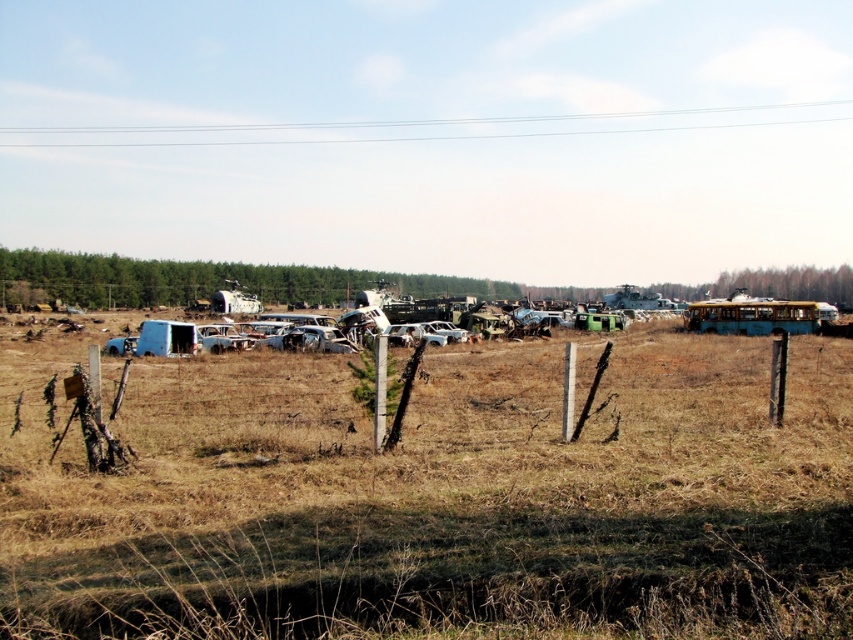
Consider the image. Does brown dry grass at center lie behind silver metallic car at center?

No, it is in front of silver metallic car at center.

Locate an element on the screen. The image size is (853, 640). brown dry grass at center is located at coordinates (434, 493).

The width and height of the screenshot is (853, 640). Find the location of `brown dry grass at center`. brown dry grass at center is located at coordinates click(434, 493).

You are a GUI agent. You are given a task and a screenshot of the screen. Output one action in this format:
    pyautogui.click(x=<x>, y=<y>)
    Task: Click on the brown dry grass at center
    
    Given the screenshot: What is the action you would take?
    pyautogui.click(x=434, y=493)

Consider the image. Who is positioned more to the left, blue matte bus at right or silver metallic car at center?

silver metallic car at center

What do you see at coordinates (753, 316) in the screenshot? I see `blue matte bus at right` at bounding box center [753, 316].

You are a GUI agent. You are given a task and a screenshot of the screen. Output one action in this format:
    pyautogui.click(x=<x>, y=<y>)
    Task: Click on the blue matte bus at right
    
    Given the screenshot: What is the action you would take?
    pyautogui.click(x=753, y=316)

Can you confirm if brown dry grass at center is taller than blue matte bus at right?

No.

This screenshot has width=853, height=640. Identify the location of brown dry grass at center. (434, 493).